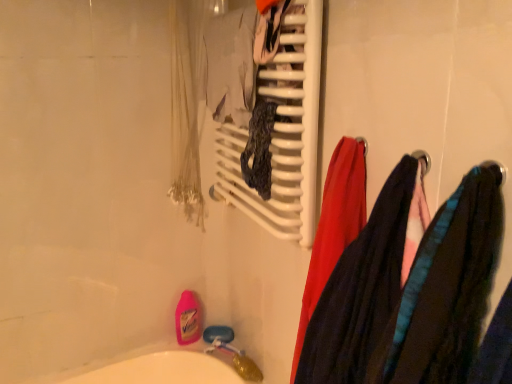
Question: In terms of width, does white plastic towel rack at upper center look wider or thinner when compared to velvet-like fabric scarf at right, which is counted as the second clothing, starting from the back?

Choices:
 (A) thin
 (B) wide

Answer: (A)

Question: Is white plastic towel rack at upper center inside or outside of velvet-like fabric scarf at right, the first clothing when ordered from front to back?

Choices:
 (A) inside
 (B) outside

Answer: (B)

Question: Which object is positioned closest to the velvet-like fabric at right, the 1th clothing positioned from the back?

Choices:
 (A) white plastic towel rack at upper center
 (B) velvet-like fabric scarf at right, which is counted as the second clothing, starting from the back

Answer: (B)

Question: Which is farther from the velvet-like fabric scarf at right, the first clothing when ordered from front to back?

Choices:
 (A) white plastic towel rack at upper center
 (B) velvet-like fabric at right, the 1th clothing positioned from the back

Answer: (A)